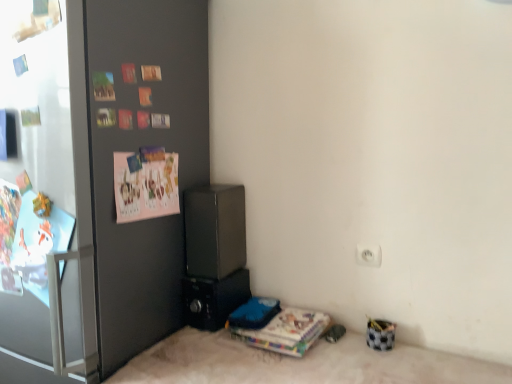
Question: Is point (218, 322) closer or farther from the camera than point (290, 332)?

Choices:
 (A) closer
 (B) farther

Answer: (B)

Question: From a real-world perspective, is black plastic speaker at lower center, positioned as the 1th appliance in bottom-to-top order, positioned above or below multicolored paper stack at lower center?

Choices:
 (A) above
 (B) below

Answer: (A)

Question: Which object is the closest to the black plastic speaker at lower center, positioned as the 1th appliance in bottom-to-top order?

Choices:
 (A) multicolored paper stack at lower center
 (B) transparent glass door at left
 (C) white glossy refrigerator at left
 (D) satin black speaker at center, the first appliance positioned from the top
 (E) pink paper postcard at upper left

Answer: (D)

Question: Which of these objects is positioned farthest from the pink paper postcard at upper left?

Choices:
 (A) satin black speaker at center, marked as the second appliance in a bottom-to-top arrangement
 (B) transparent glass door at left
 (C) black plastic speaker at lower center, positioned as the 1th appliance in bottom-to-top order
 (D) white glossy refrigerator at left
 (E) multicolored paper stack at lower center

Answer: (E)